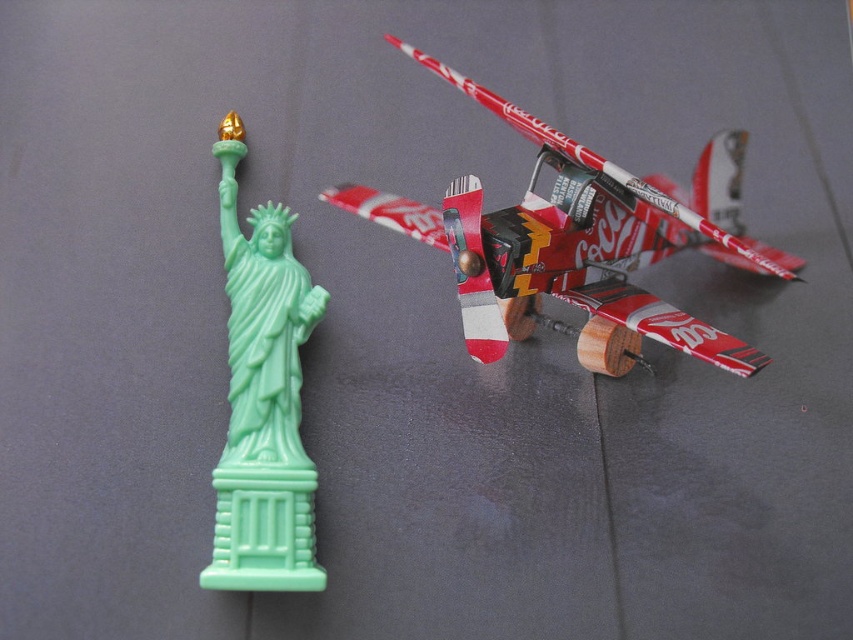
Question: Is red and white paper airplane at right below mint green plastic statue of liberty at left?

Choices:
 (A) yes
 (B) no

Answer: (B)

Question: Is red and white paper airplane at right behind mint green plastic statue of liberty at left?

Choices:
 (A) no
 (B) yes

Answer: (A)

Question: Which object is closer to the camera taking this photo?

Choices:
 (A) mint green plastic statue of liberty at left
 (B) red and white paper airplane at right

Answer: (B)

Question: Is red and white paper airplane at right thinner than mint green plastic statue of liberty at left?

Choices:
 (A) yes
 (B) no

Answer: (B)

Question: Which point appears closest to the camera in this image?

Choices:
 (A) (293, 356)
 (B) (727, 220)

Answer: (A)